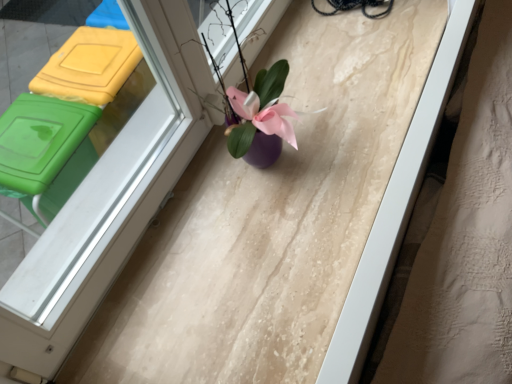
Locate an element on the screen. white plastic window frame at center is located at coordinates (111, 196).

In order to face white plastic window frame at center, should I rotate leftwards or rightwards?

To align with it, rotate left about 12.073°.

This screenshot has width=512, height=384. What do you see at coordinates (111, 196) in the screenshot? I see `white plastic window frame at center` at bounding box center [111, 196].

The image size is (512, 384). I want to click on white plastic window frame at center, so click(111, 196).